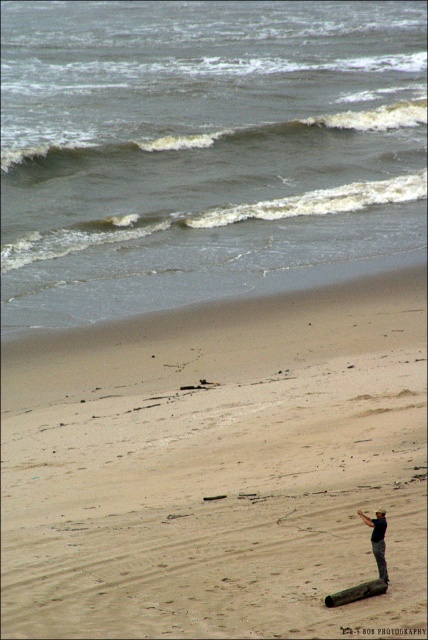
Which is more to the right, sandy beach at lower center or brown wood log at lower right?

brown wood log at lower right

Does point (270, 524) come closer to viewer compared to point (356, 596)?

No, it is not.

Is point (184, 369) farther from viewer compared to point (338, 604)?

Yes, it is behind point (338, 604).

The image size is (428, 640). In order to click on sandy beach at lower center in this screenshot , I will do `click(217, 467)`.

Is point (83, 563) farther from viewer compared to point (386, 563)?

Yes, it is.

Between sandy beach at lower center and dark blue fabric at lower right, which one is positioned lower?

dark blue fabric at lower right is lower down.

Measure the distance between point [217,538] and camera.

The distance of point [217,538] from camera is 19.07 meters.

Identify the location of sandy beach at lower center. Image resolution: width=428 pixels, height=640 pixels. (217, 467).

Where is `dark blue fabric at lower right`? dark blue fabric at lower right is located at coordinates (377, 540).

Describe the element at coordinates (377, 540) in the screenshot. This screenshot has height=640, width=428. I see `dark blue fabric at lower right` at that location.

At what (x,y) coordinates should I click in order to perform the action: click on dark blue fabric at lower right. Please return your answer as a coordinate pair (x, y). This screenshot has width=428, height=640. Looking at the image, I should click on (377, 540).